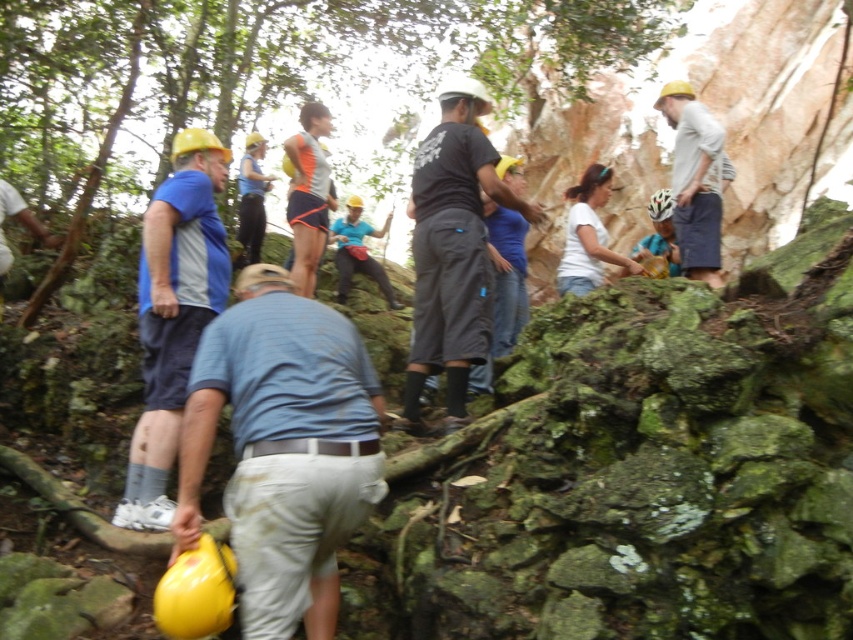
You are an observer standing in the forest scene. You notice the blue fabric shirt at left and the matte white helmet at upper right. Which object is higher in position?

The blue fabric shirt at left is taller than the matte white helmet at upper right.